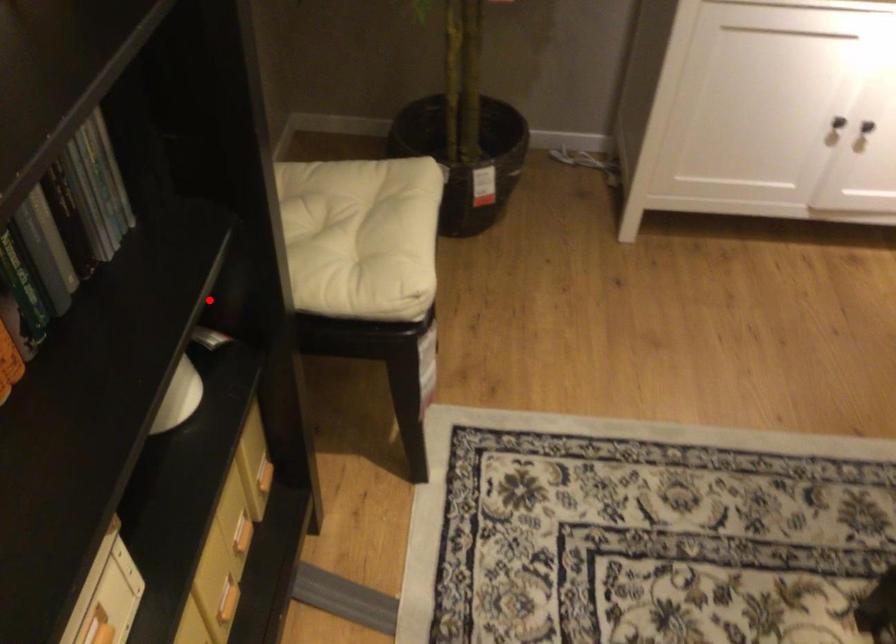
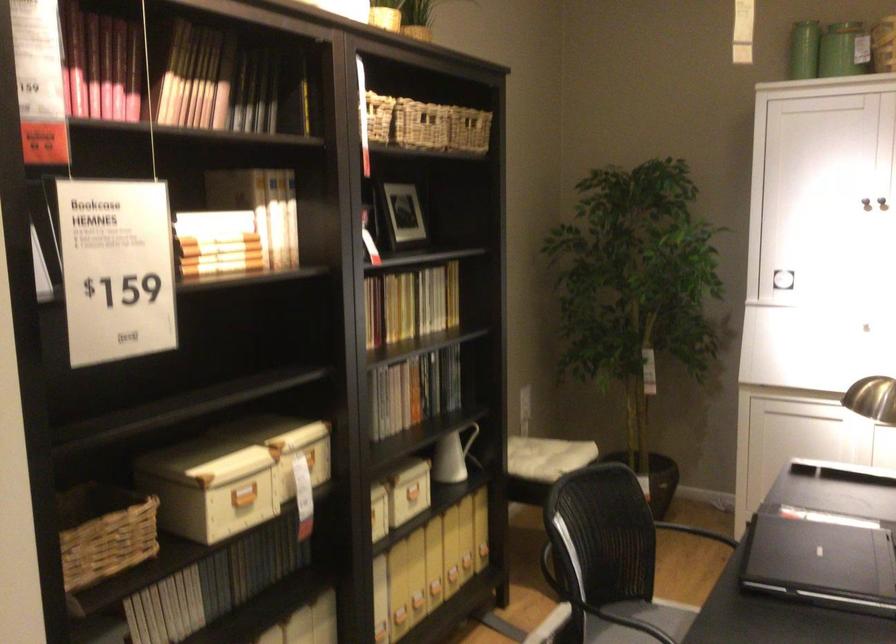
Question: I am providing you with two images of the same scene from different viewpoints. A red point is shown in image1. For the corresponding object point in image2, is it positioned nearer or farther from the camera?

Choices:
 (A) Nearer
 (B) Farther

Answer: (B)